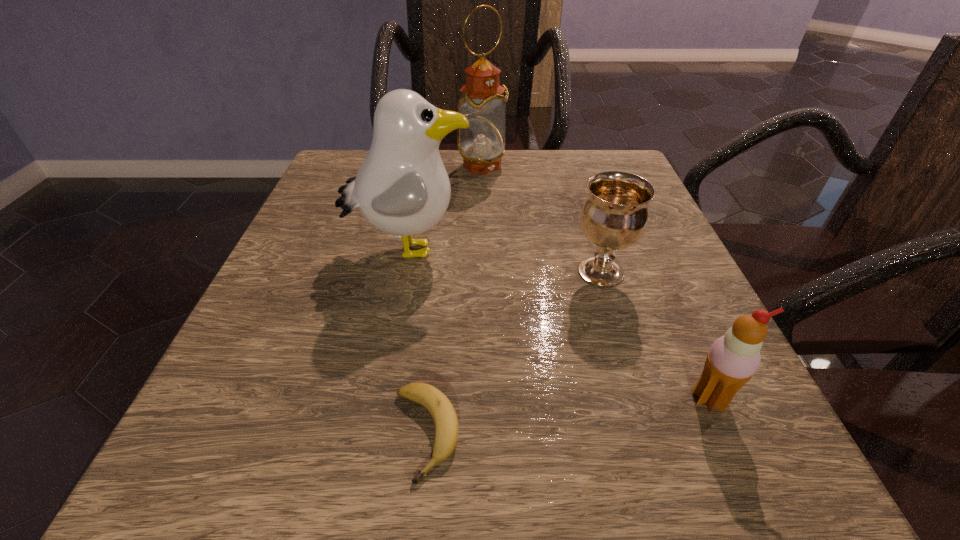
Image resolution: width=960 pixels, height=540 pixels. I want to click on vacant space at the far right corner of the desktop, so click(x=593, y=166).

In the image, there is a desktop. At what (x,y) coordinates should I click in order to perform the action: click on vacant space at the near right corner. Please return your answer as a coordinate pair (x, y). Looking at the image, I should click on 689,471.

Locate an element on the screen. This screenshot has width=960, height=540. empty space between the second tallest object and the rightmost object is located at coordinates (560, 323).

Where is `empty space between the shortest object and the oil lamp`? The height and width of the screenshot is (540, 960). empty space between the shortest object and the oil lamp is located at coordinates (454, 299).

Find the location of a particular element. vacant point located between the shortest object and the gull is located at coordinates (418, 341).

Where is `free space between the rightmost object and the chalice`? The width and height of the screenshot is (960, 540). free space between the rightmost object and the chalice is located at coordinates (656, 335).

Identify the location of vacant space that's between the rightmost object and the second object from right to left. The image size is (960, 540). (656, 335).

You are a GUI agent. You are given a task and a screenshot of the screen. Output one action in this format:
    pyautogui.click(x=<x>, y=<y>)
    Task: Click on the free space between the banana and the oil lamp
    The image size is (960, 540).
    Given the screenshot: What is the action you would take?
    pyautogui.click(x=454, y=299)

The width and height of the screenshot is (960, 540). I want to click on vacant space that is in between the farthest object and the shortest object, so click(x=454, y=299).

Find the location of a particular element. This screenshot has width=960, height=540. unoccupied area between the second tallest object and the icecream is located at coordinates (560, 323).